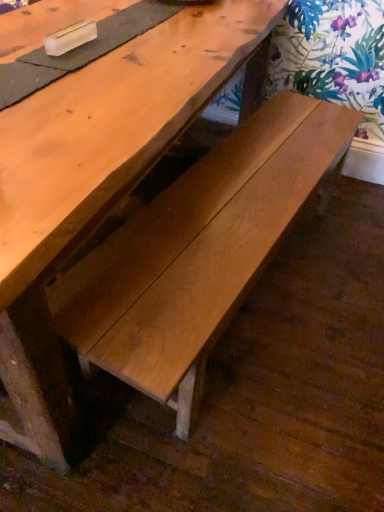
Locate an element on the screen. light brown wood bench at center is located at coordinates (222, 267).

Image resolution: width=384 pixels, height=512 pixels. Describe the element at coordinates (222, 267) in the screenshot. I see `light brown wood bench at center` at that location.

In order to face light brown wood bench at center, should I rotate leftwards or rightwards?

Turn right by 6.208 degrees to look at light brown wood bench at center.

Where is `light brown wood bench at center`? The image size is (384, 512). light brown wood bench at center is located at coordinates (222, 267).